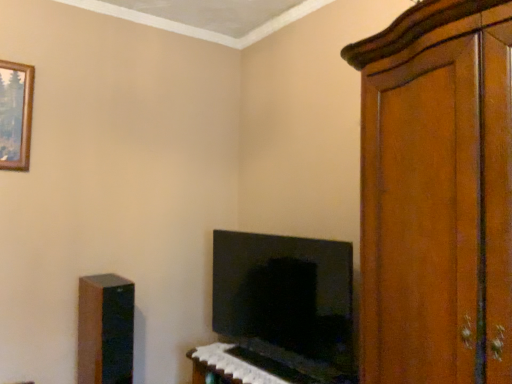
You are a GUI agent. You are given a task and a screenshot of the screen. Output one action in this format:
    pyautogui.click(x=<x>, y=<y>)
    Task: Click on the matte black tv at center
    The height and width of the screenshot is (384, 512).
    Given the screenshot: What is the action you would take?
    pyautogui.click(x=287, y=302)

The image size is (512, 384). Describe the element at coordinates (287, 302) in the screenshot. I see `matte black tv at center` at that location.

Find the location of `matte black tv at center`. matte black tv at center is located at coordinates (x=287, y=302).